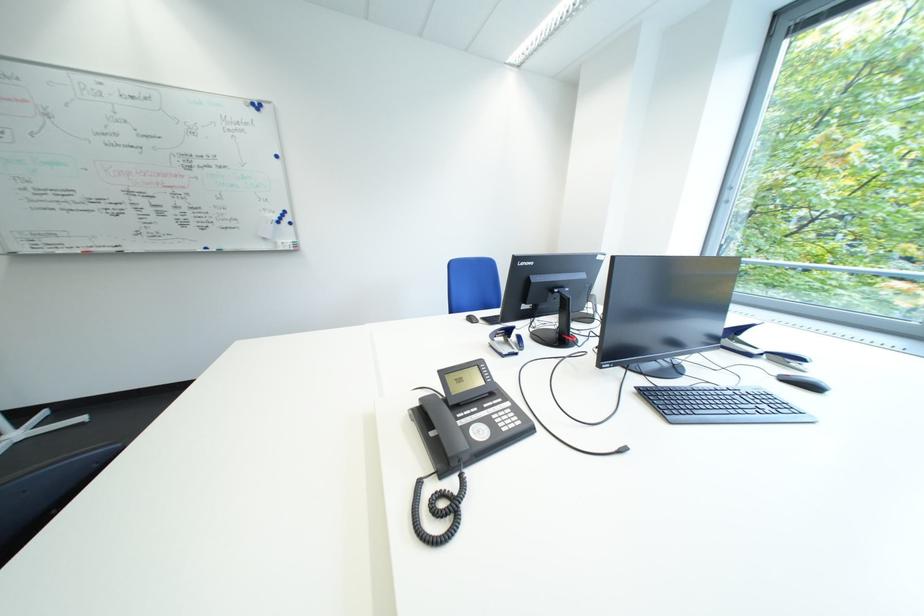
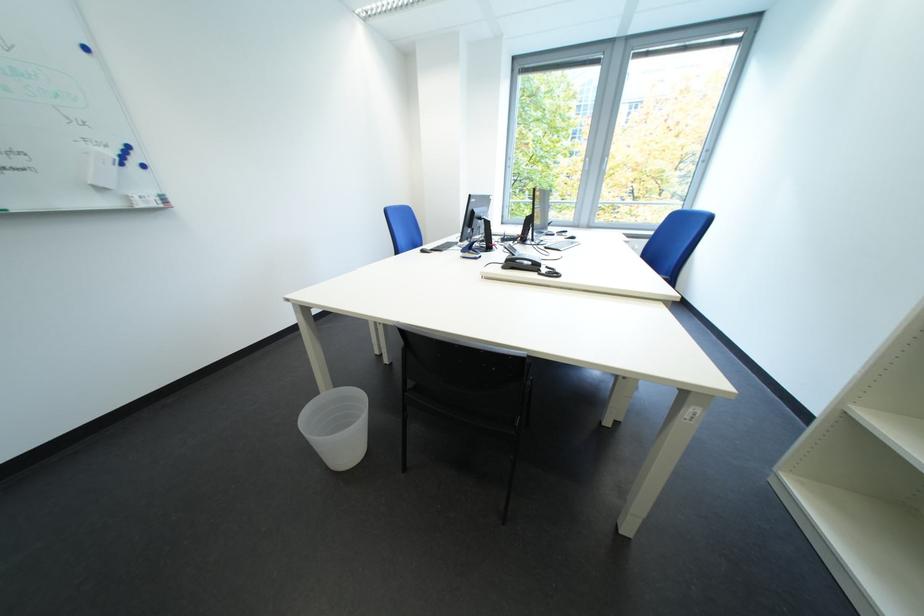
In the second image, find the point that corresponds to (299,251) in the first image.

(165, 208)